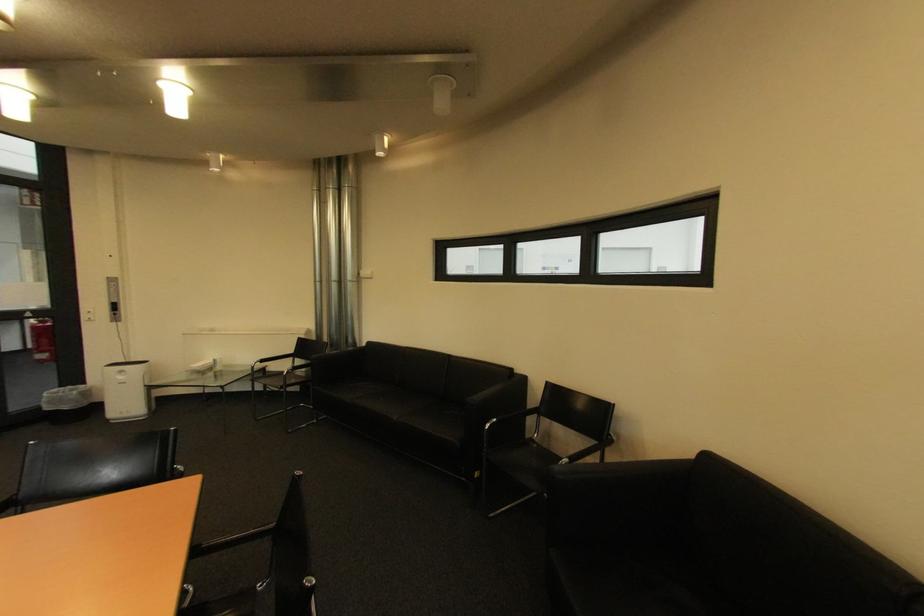
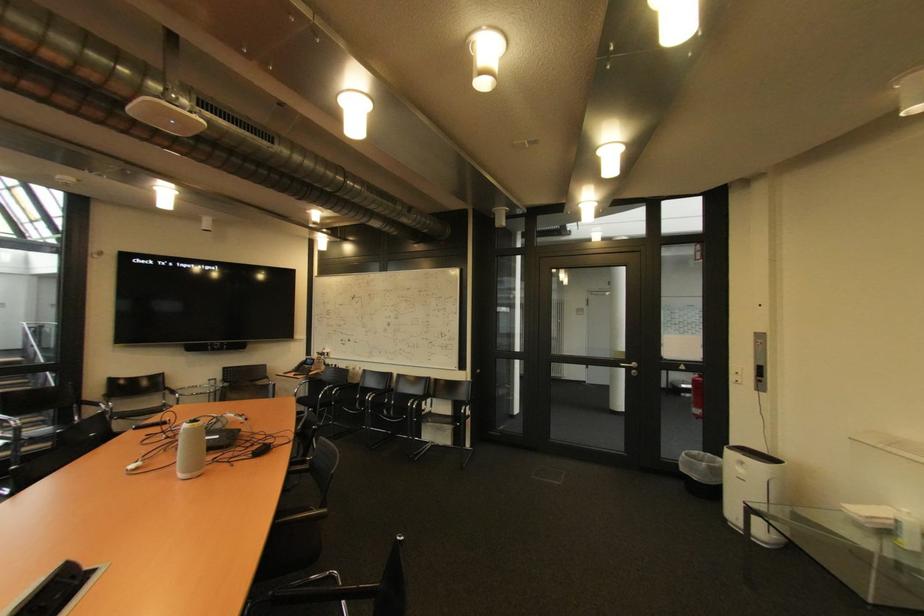
Find the pixel in the second image that matches the point at 55,410 in the first image.

(690, 471)